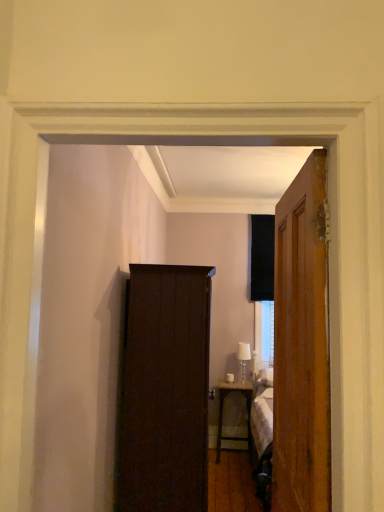
Measure the distance between metallic silver desk at center and camera.

metallic silver desk at center and camera are 12.14 feet apart.

Measure the distance between point (143, 303) and camera.

They are 2.56 meters apart.

The height and width of the screenshot is (512, 384). What do you see at coordinates (165, 390) in the screenshot?
I see `dark wood cabinet at center` at bounding box center [165, 390].

This screenshot has height=512, width=384. What do you see at coordinates (301, 346) in the screenshot?
I see `wooden door at right` at bounding box center [301, 346].

Locate an element on the screen. The width and height of the screenshot is (384, 512). metallic silver desk at center is located at coordinates pyautogui.click(x=223, y=406).

Consider the image. Does clear glass lampshade at right have a lesser height compared to wooden door at right?

Yes.

From the image's perspective, is clear glass lampshade at right below wooden door at right?

Yes.

Which of these two, clear glass lampshade at right or wooden door at right, is wider?

With larger width is wooden door at right.

Is clear glass lampshade at right situated inside wooden door at right or outside?

clear glass lampshade at right exists outside the volume of wooden door at right.

Is point (290, 505) positioned behind point (241, 387)?

That is False.

Find the location of a particular element. door on the left of the metallic silver desk at center is located at coordinates (301, 346).

From the image's perspective, does wooden door at right appear higher than metallic silver desk at center?

Yes, from the image's perspective, wooden door at right is above metallic silver desk at center.

Based on the photo, is wooden door at right not within metallic silver desk at center?

Yes, wooden door at right is outside of metallic silver desk at center.

How much distance is there between wooden door at right and clear glass lampshade at right?

A distance of 3.08 meters exists between wooden door at right and clear glass lampshade at right.

Considering the positions of points (302, 311) and (242, 358), is point (302, 311) farther from camera compared to point (242, 358)?

No, it is in front of (242, 358).

Who is bigger, wooden door at right or clear glass lampshade at right?

Bigger between the two is wooden door at right.

How many degrees apart are the facing directions of wooden door at right and clear glass lampshade at right?

The facing directions of wooden door at right and clear glass lampshade at right are 89.2 degrees apart.

From a real-world perspective, is clear glass lampshade at right positioned over dark wood cabinet at center based on gravity?

Indeed, from a real-world perspective, clear glass lampshade at right stands above dark wood cabinet at center.

Is clear glass lampshade at right inside or outside of dark wood cabinet at center?

clear glass lampshade at right is outside dark wood cabinet at center.

Is clear glass lampshade at right to the left of dark wood cabinet at center from the viewer's perspective?

No.

Can you confirm if clear glass lampshade at right is shorter than dark wood cabinet at center?

Indeed, clear glass lampshade at right has a lesser height compared to dark wood cabinet at center.

Which point is more distant from viewer, (249, 382) or (243, 370)?

Positioned behind is point (243, 370).

Is metallic silver desk at center spatially inside clear glass lampshade at right, or outside of it?

metallic silver desk at center is spatially situated outside clear glass lampshade at right.

Is metallic silver desk at center positioned with its back to clear glass lampshade at right?

That's not correct — metallic silver desk at center is not looking away from clear glass lampshade at right.

Looking at this image, considering their positions, is metallic silver desk at center located in front of or behind clear glass lampshade at right?

metallic silver desk at center is positioned closer to the viewer than clear glass lampshade at right.

Find the location of a particular element. This screenshot has height=512, width=384. desk that is behind the wooden door at right is located at coordinates (223, 406).

Is metallic silver desk at center to the left of wooden door at right from the viewer's perspective?

In fact, metallic silver desk at center is to the right of wooden door at right.

Does point (247, 436) come closer to viewer compared to point (310, 490)?

No, it is behind (310, 490).

Is metallic silver desk at center smaller than wooden door at right?

Yes.

Between metallic silver desk at center and dark wood cabinet at center, which one has smaller width?

metallic silver desk at center.

Between metallic silver desk at center and dark wood cabinet at center, which one is positioned behind?

metallic silver desk at center is behind.

Who is taller, metallic silver desk at center or dark wood cabinet at center?

dark wood cabinet at center is taller.

Is dark wood cabinet at center located within metallic silver desk at center?

That's incorrect, dark wood cabinet at center is not inside metallic silver desk at center.

Find the location of a particular element. Image resolution: width=384 pixels, height=512 pixels. lamp below the wooden door at right (from a real-world perspective) is located at coordinates (243, 360).

At what (x,y) coordinates should I click in order to perform the action: click on door in front of the metallic silver desk at center. Please return your answer as a coordinate pair (x, y). This screenshot has height=512, width=384. Looking at the image, I should click on (301, 346).

Estimate the real-world distances between objects in this image. Which object is closer to dark wood cabinet at center, wooden door at right or metallic silver desk at center?

wooden door at right is positioned closer to the anchor dark wood cabinet at center.

When comparing their distances from metallic silver desk at center, does clear glass lampshade at right or dark wood cabinet at center seem further?

The object further to metallic silver desk at center is dark wood cabinet at center.

When comparing their distances from metallic silver desk at center, does clear glass lampshade at right or wooden door at right seem closer?

clear glass lampshade at right lies closer to metallic silver desk at center than the other object.

Based on their spatial positions, is clear glass lampshade at right or dark wood cabinet at center closer to wooden door at right?

dark wood cabinet at center is closer to wooden door at right.

From the picture: Estimate the real-world distances between objects in this image. Which object is further from wooden door at right, metallic silver desk at center or clear glass lampshade at right?

The object further to wooden door at right is clear glass lampshade at right.

Based on their spatial positions, is wooden door at right or clear glass lampshade at right further from dark wood cabinet at center?

clear glass lampshade at right lies further to dark wood cabinet at center than the other object.

When comparing their distances from wooden door at right, does dark wood cabinet at center or metallic silver desk at center seem closer?

dark wood cabinet at center is closer to wooden door at right.

When comparing their distances from dark wood cabinet at center, does clear glass lampshade at right or wooden door at right seem closer?

Among the two, wooden door at right is located nearer to dark wood cabinet at center.

The width and height of the screenshot is (384, 512). Identify the location of cabinetry between wooden door at right and metallic silver desk at center from front to back. (165, 390).

Locate an element on the screen. The width and height of the screenshot is (384, 512). desk positioned between dark wood cabinet at center and clear glass lampshade at right from near to far is located at coordinates (223, 406).

Identify the location of cabinetry between wooden door at right and clear glass lampshade at right in the front-back direction. The height and width of the screenshot is (512, 384). (165, 390).

Identify the location of desk between wooden door at right and clear glass lampshade at right in the front-back direction. (223, 406).